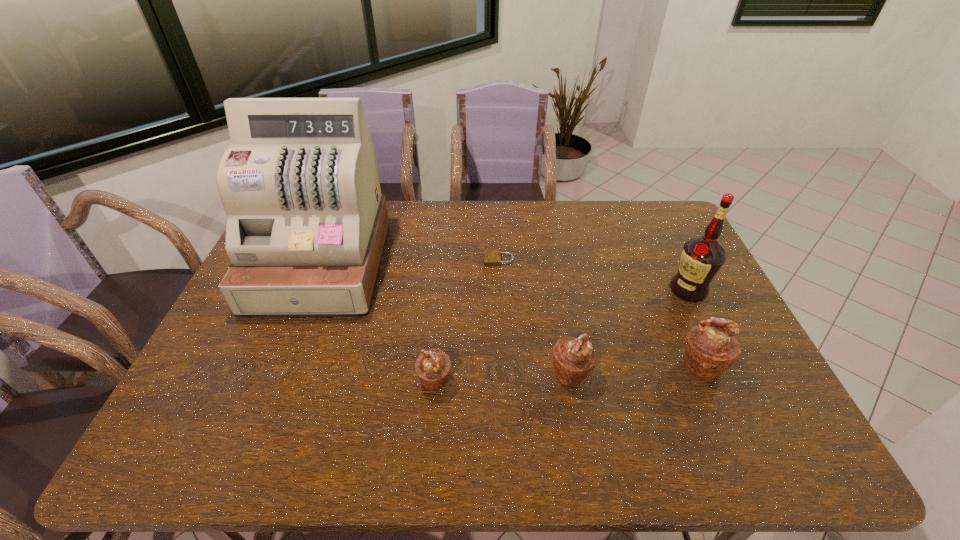
Identify the location of object at the far edge. (306, 227).

You are a GUI agent. You are given a task and a screenshot of the screen. Output one action in this format:
    pyautogui.click(x=<x>, y=<y>)
    Task: Click on the object that is at the left edge
    The image size is (960, 540).
    Given the screenshot: What is the action you would take?
    pyautogui.click(x=306, y=227)

The image size is (960, 540). What are the coordinates of `muffin at the right edge` in the screenshot? It's located at (711, 349).

Where is `alcohol present at the right edge`? Image resolution: width=960 pixels, height=540 pixels. alcohol present at the right edge is located at coordinates (702, 257).

Locate an element on the screen. The height and width of the screenshot is (540, 960). object present at the far left corner is located at coordinates (306, 227).

Identify the location of object present at the near right corner. Image resolution: width=960 pixels, height=540 pixels. (711, 349).

I want to click on vacant space at the far edge of the desktop, so pos(585,231).

The height and width of the screenshot is (540, 960). Find the location of `vacant space at the left edge of the desktop`. vacant space at the left edge of the desktop is located at coordinates (253, 328).

Locate an element on the screen. Image resolution: width=960 pixels, height=540 pixels. free space at the right edge of the desktop is located at coordinates point(683,310).

The height and width of the screenshot is (540, 960). Identify the location of free space at the near left corner of the desktop. (198, 396).